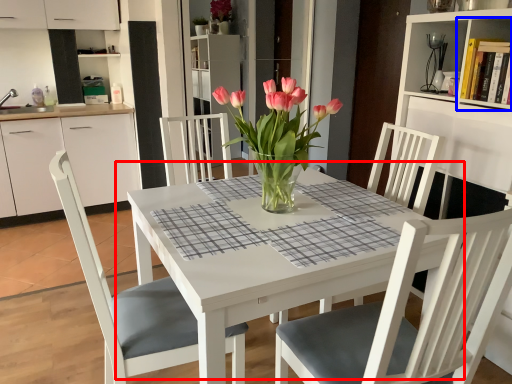
Question: Among these objects, which one is farthest to the camera, kitchen & dining room table (highlighted by a red box) or shelf (highlighted by a blue box)?

Choices:
 (A) kitchen & dining room table
 (B) shelf

Answer: (B)